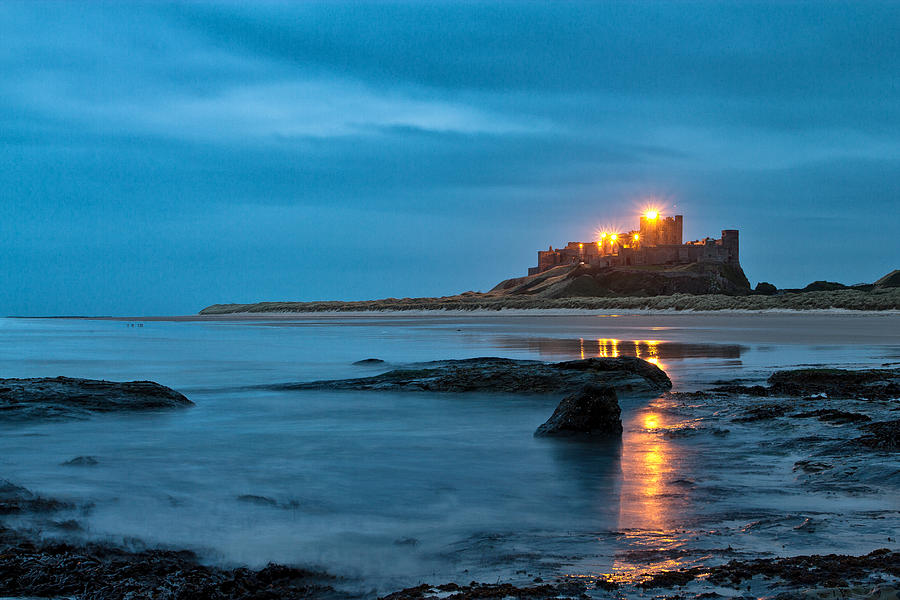
Locate an element on the screen. Image resolution: width=900 pixels, height=600 pixels. lights is located at coordinates (649, 212), (635, 232), (607, 232), (608, 238).